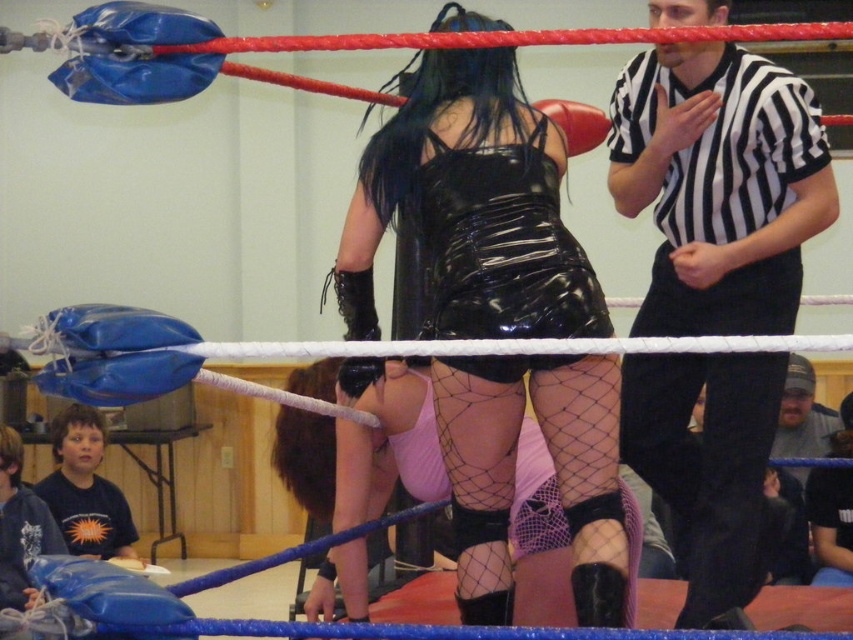
Does black shiny dress at center have a greater width compared to black leather boxing glove at center?

Correct, the width of black shiny dress at center exceeds that of black leather boxing glove at center.

Identify the location of black shiny dress at center. The height and width of the screenshot is (640, 853). 476,204.

Does point (521, 115) come behind point (369, 298)?

No.

You are a GUI agent. You are given a task and a screenshot of the screen. Output one action in this format:
    pyautogui.click(x=<x>, y=<y>)
    Task: Click on the black shiny dress at center
    The image size is (853, 640).
    Given the screenshot: What is the action you would take?
    pyautogui.click(x=476, y=204)

This screenshot has width=853, height=640. In order to click on black shiny dress at center in this screenshot , I will do `click(476, 204)`.

Does black shiny dress at center have a smaller size compared to black striped shirt at upper right?

Yes, black shiny dress at center is smaller than black striped shirt at upper right.

Identify the location of black shiny dress at center. (476, 204).

Looking at this image, is black shiny dress at center taller than fishnet stockings at center?

Correct, black shiny dress at center is much taller as fishnet stockings at center.

Between black shiny dress at center and fishnet stockings at center, which one appears on the right side from the viewer's perspective?

black shiny dress at center

Who is more distant from viewer, (x=433, y=88) or (x=432, y=477)?

Point (x=432, y=477)

Identify the location of black shiny dress at center. (476, 204).